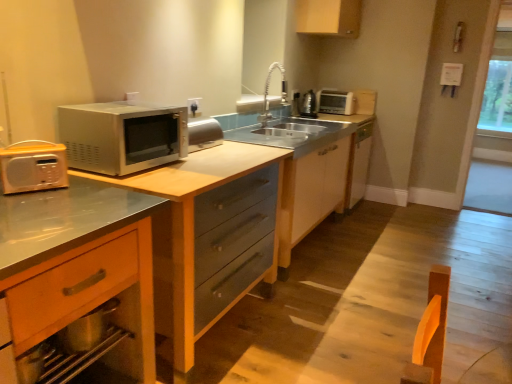
In order to click on space that is in front of transparent glass window at right, which is counted as the first window screen, starting from the left in this screenshot , I will do `click(497, 216)`.